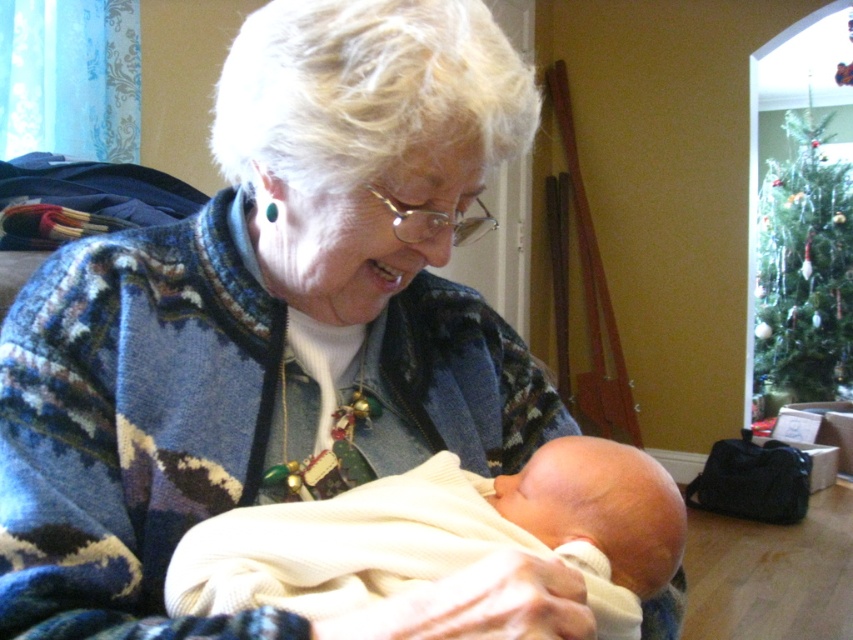
Is white knit sweater at center below green matte christmas tree at upper right?

Yes.

Does point (431, 497) lie in front of point (849, 243)?

Yes, it is in front of point (849, 243).

Locate an element on the screen. This screenshot has width=853, height=640. white knit sweater at center is located at coordinates (445, 536).

The height and width of the screenshot is (640, 853). Identify the location of white knit sweater at center. (445, 536).